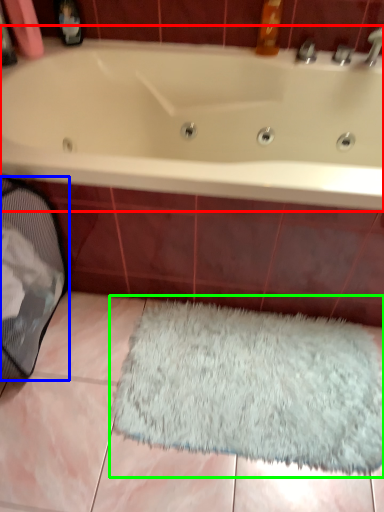
Question: Which object is the closest to the bathtub (highlighted by a red box)? Choose among these: laundry basket (highlighted by a blue box) or doormat (highlighted by a green box).

Choices:
 (A) laundry basket
 (B) doormat

Answer: (A)